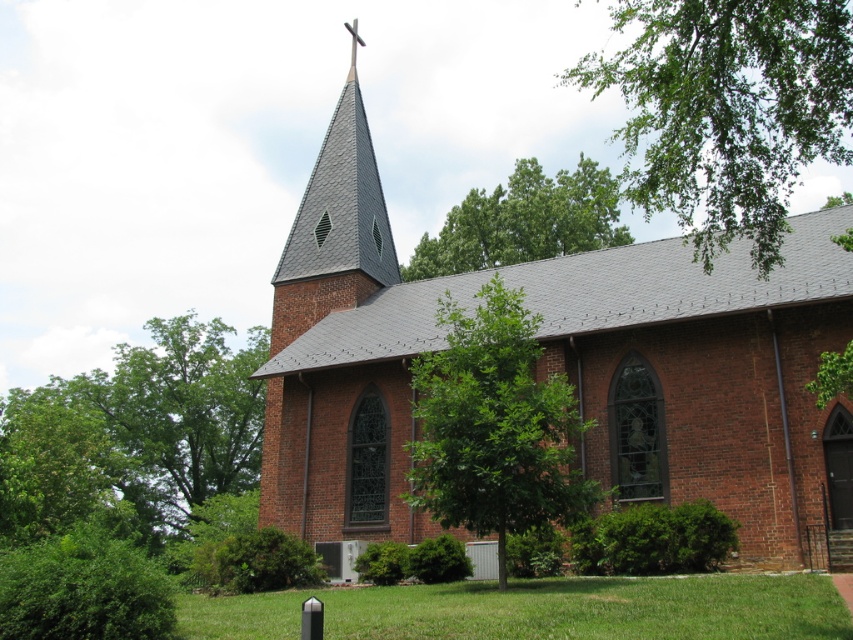
You are standing in front of the church and notice two green leafy trees. One is labeled as the green leafy tree at left and the other as the green leafy tree at upper center. Which tree is positioned further to the left?

The green leafy tree at left is positioned further to the left compared to the green leafy tree at upper center.

You are standing in front of the church and notice two green leafy trees. One is labeled as the green leafy tree at center and the other as the green leafy tree at upper center. Which tree has a smaller width?

The green leafy tree at center has a smaller width compared to the green leafy tree at upper center.